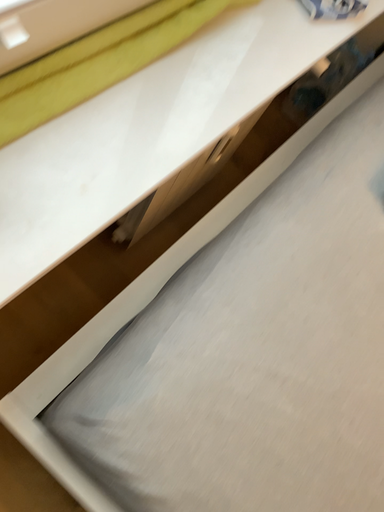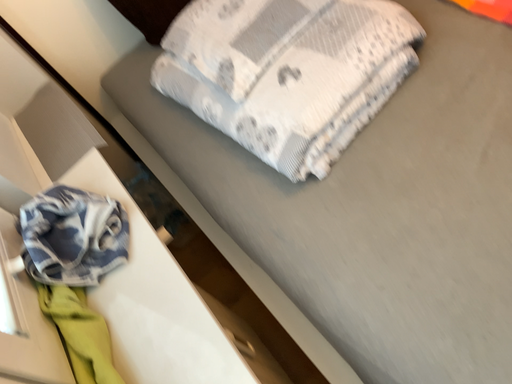
Question: Which way did the camera rotate in the video?

Choices:
 (A) rotated downward
 (B) rotated upward

Answer: (B)